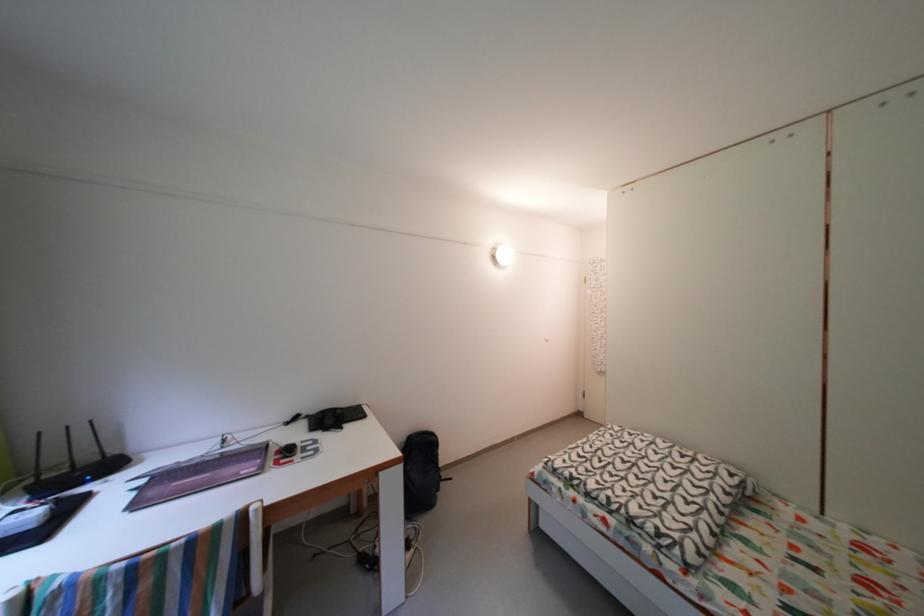
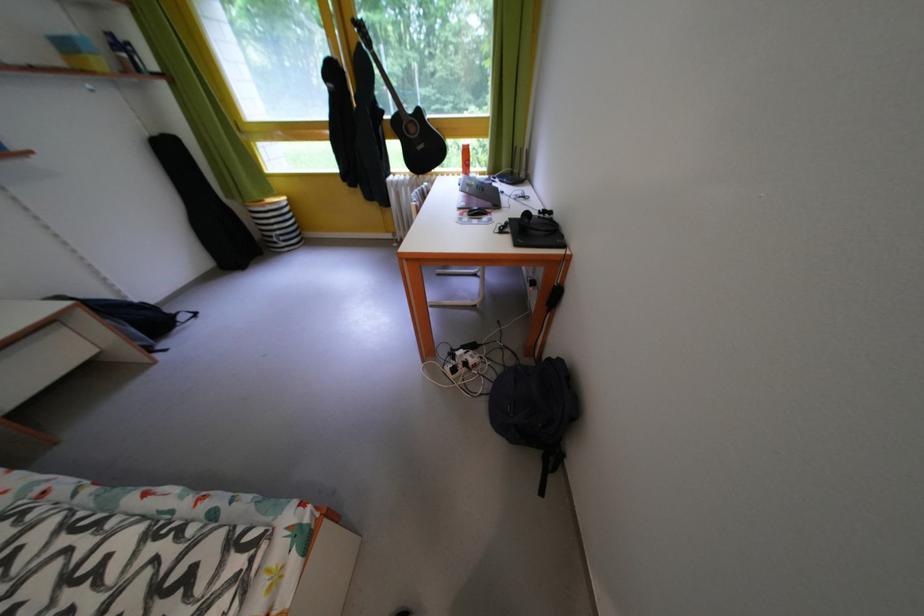
Find the pixel in the second image that matches (297,429) in the first image.

(550, 217)